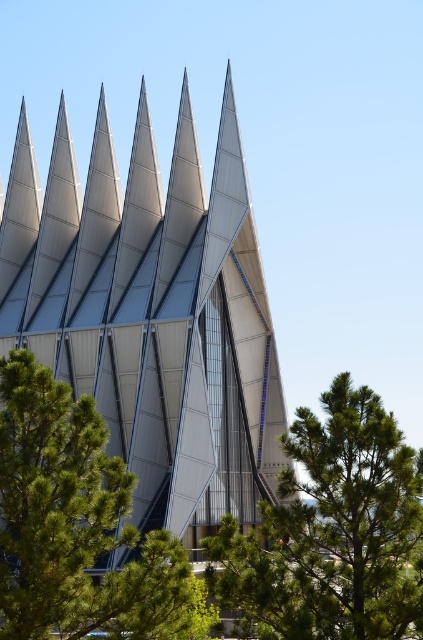
Question: Does metallic glass spires at center have a greater width compared to green leafy tree at center?

Choices:
 (A) no
 (B) yes

Answer: (B)

Question: Which point appears farthest from the camera in this image?

Choices:
 (A) click(x=395, y=461)
 (B) click(x=16, y=147)
 (C) click(x=156, y=586)

Answer: (B)

Question: Is metallic glass spires at center in front of green needle-like leaves at center?

Choices:
 (A) yes
 (B) no

Answer: (B)

Question: Which object is closer to the camera taking this photo?

Choices:
 (A) metallic glass spires at center
 (B) green leafy tree at center

Answer: (B)

Question: Can you confirm if metallic glass spires at center is wider than green leafy tree at center?

Choices:
 (A) yes
 (B) no

Answer: (A)

Question: Which of the following is the closest to the observer?

Choices:
 (A) (370, 490)
 (B) (84, 556)
 (C) (214, 275)

Answer: (B)